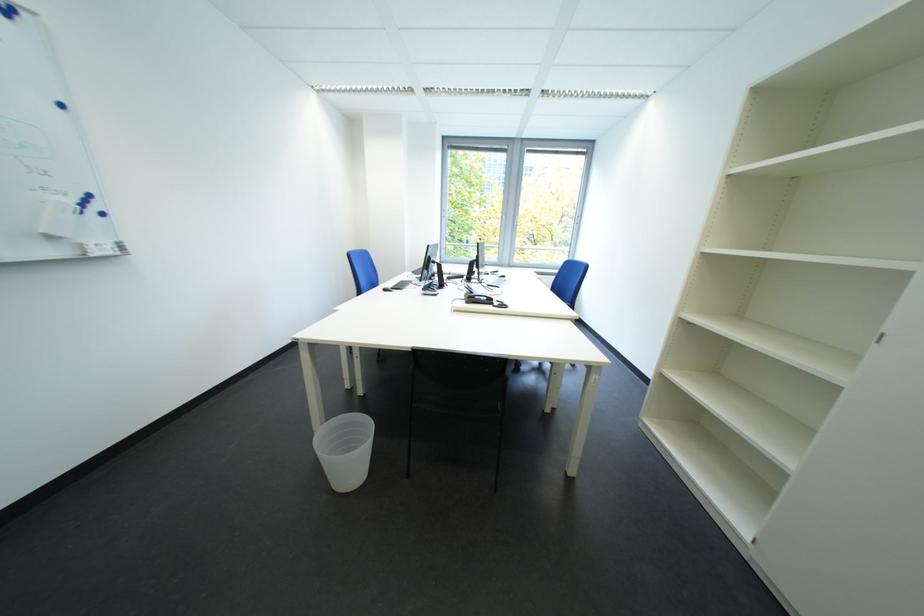
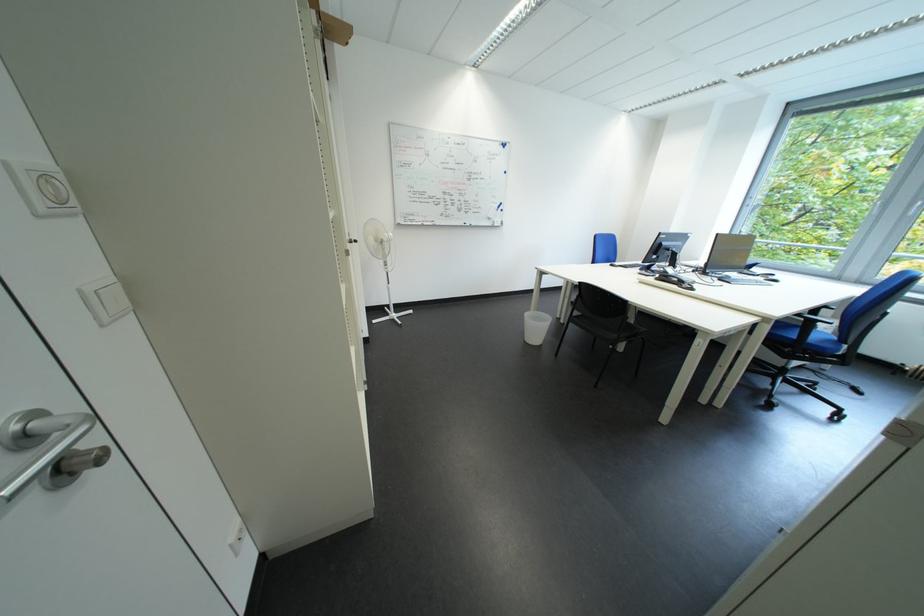
The point at (x=480, y=305) is marked in the first image. Where is the corresponding point in the second image?

(669, 282)